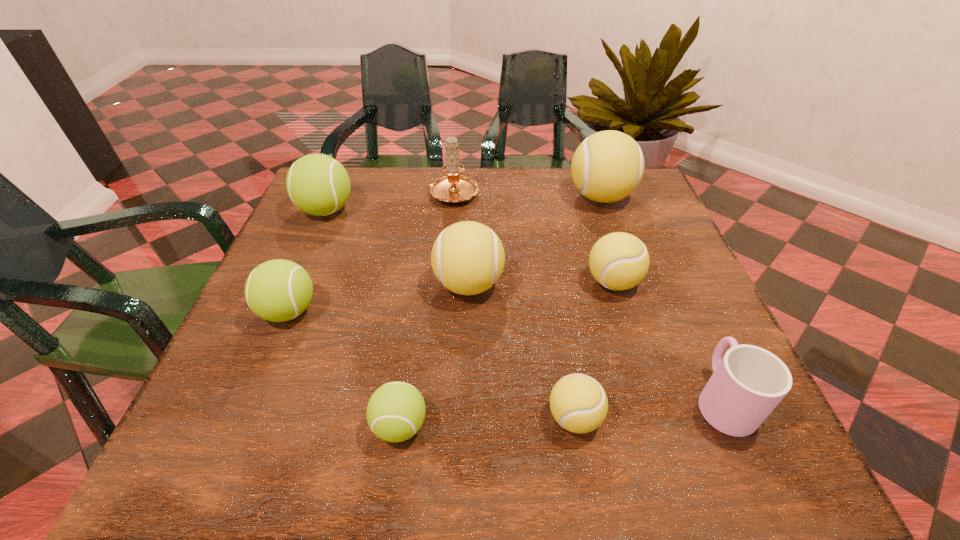
The height and width of the screenshot is (540, 960). Find the location of `green tennis ball object that ranks as the second closest to the farthest yellow tennis ball`. green tennis ball object that ranks as the second closest to the farthest yellow tennis ball is located at coordinates (395, 412).

Locate which green tennis ball ranks third in proximity to the tallest tennis ball. Please provide its 2D coordinates. Your answer should be formatted as a tuple, i.e. [(x, y)], where the tuple contains the x and y coordinates of a point satisfying the conditions above.

[(279, 290)]

The image size is (960, 540). I want to click on vacant position in the image that satisfies the following two spatial constraints: 1. on the back side of the second nearest green tennis ball; 2. on the right side of the second smallest yellow tennis ball, so click(300, 282).

You are a GUI agent. You are given a task and a screenshot of the screen. Output one action in this format:
    pyautogui.click(x=<x>, y=<y>)
    Task: Click on the free spot that satisfies the following two spatial constraints: 1. on the front side of the nearest yellow tennis ball; 2. on the right side of the biggest green tennis ball
    Image resolution: width=960 pixels, height=540 pixels.
    Given the screenshot: What is the action you would take?
    click(x=237, y=417)

What are the coordinates of `vacant space that satisfies the following two spatial constraints: 1. on the front side of the biggest green tennis ball; 2. on the right side of the third biggest yellow tennis ball` in the screenshot? It's located at (296, 282).